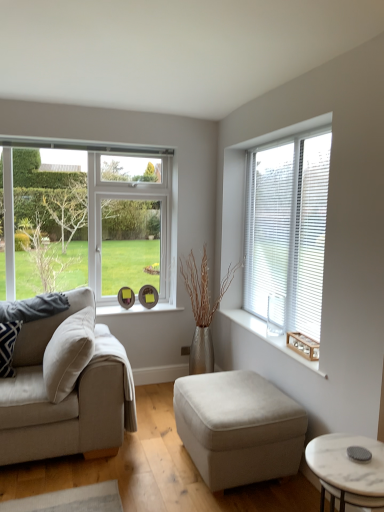
The height and width of the screenshot is (512, 384). I want to click on vacant area on top of beige fabric ottoman at center (from a real-world perspective), so pyautogui.click(x=235, y=392).